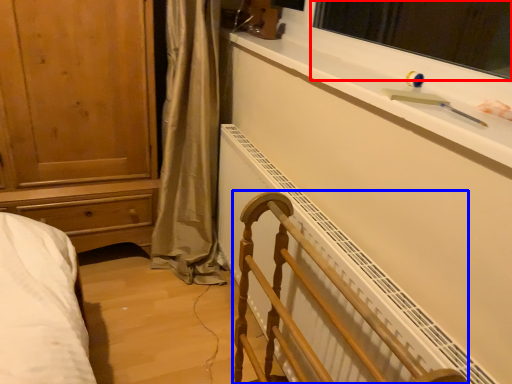
Question: Which object is further to the camera taking this photo, window screen (highlighted by a red box) or furniture (highlighted by a blue box)?

Choices:
 (A) window screen
 (B) furniture

Answer: (A)